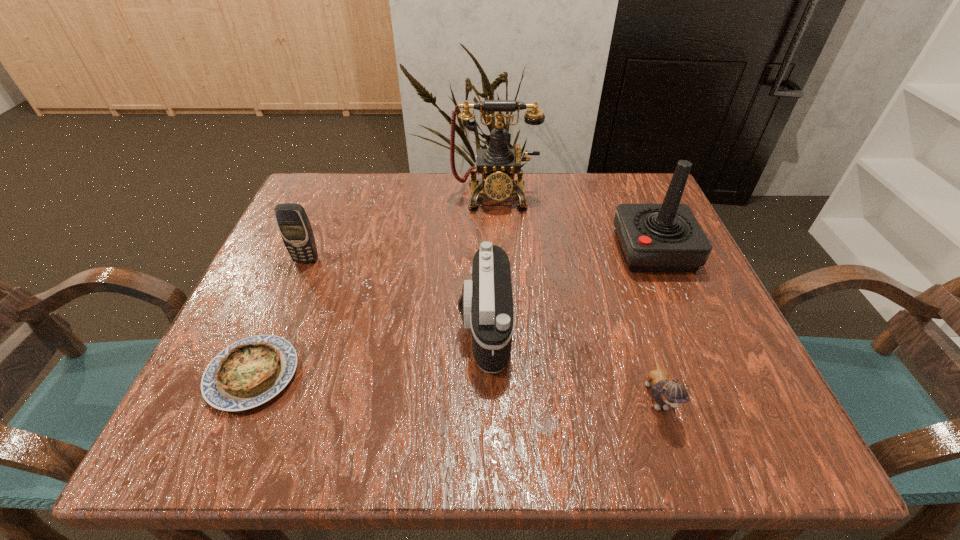
Find the location of a particular element. The height and width of the screenshot is (540, 960). empty space between the telephone and the joystick is located at coordinates (574, 222).

Image resolution: width=960 pixels, height=540 pixels. Find the location of `object identified as the closest to the camera`. object identified as the closest to the camera is located at coordinates (666, 392).

Find the location of a particular element. the fourth closest object to the second shortest object is located at coordinates (249, 372).

Locate an element on the screen. This screenshot has height=540, width=960. free space that satisfies the following two spatial constraints: 1. on the front-facing side of the joystick; 2. on the front face of the cellular telephone is located at coordinates (658, 260).

You are a GUI agent. You are given a task and a screenshot of the screen. Output one action in this format:
    pyautogui.click(x=<x>, y=<y>)
    Task: Click on the blank space that satisfies the following two spatial constraints: 1. on the front lens of the camera; 2. on the front side of the quiche
    
    Given the screenshot: What is the action you would take?
    pyautogui.click(x=485, y=374)